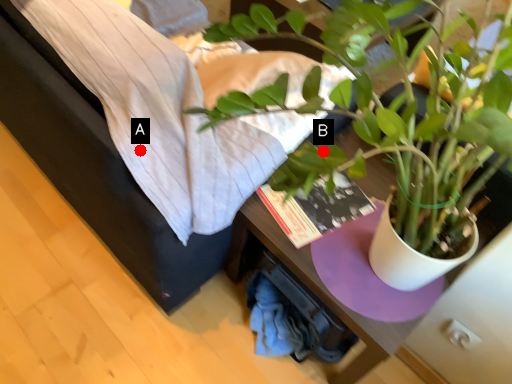
Question: Two points are circled on the image, labeled by A and B beside each circle. Which point is farther to the camera?

Choices:
 (A) A is further
 (B) B is further

Answer: (A)